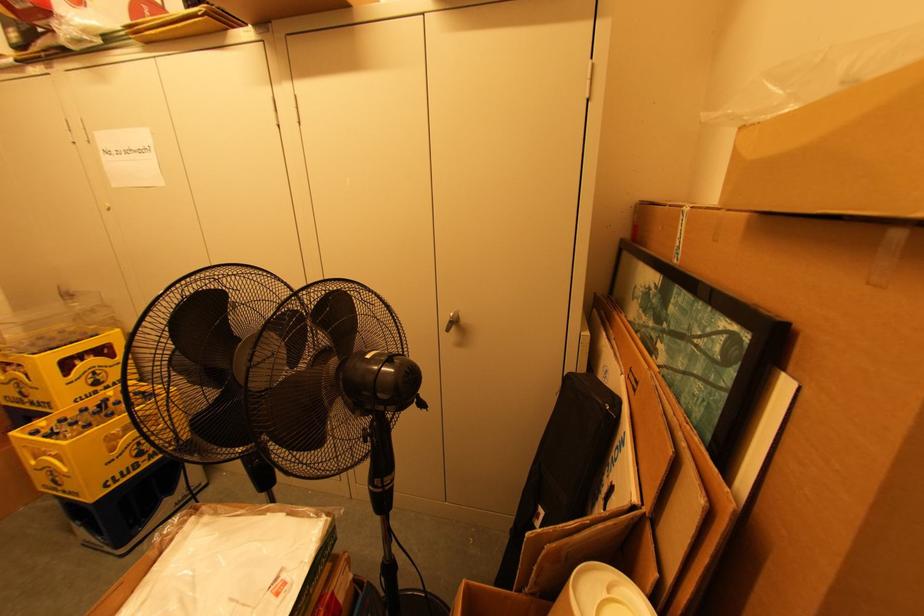
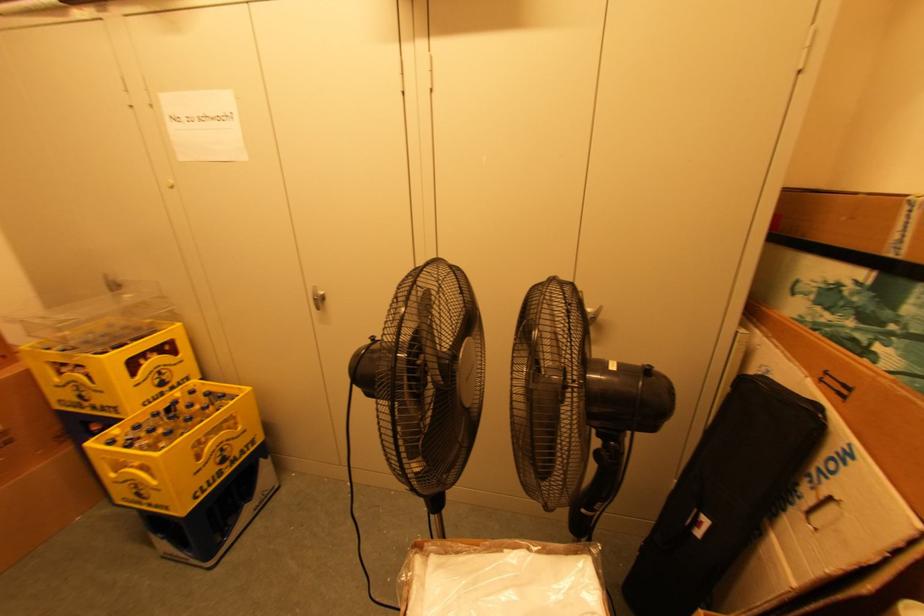
Question: Based on the continuous images, in which direction is the camera rotating? Reply with the corresponding letter.

Choices:
 (A) Left
 (B) Right
 (C) Up
 (D) Down

Answer: (D)